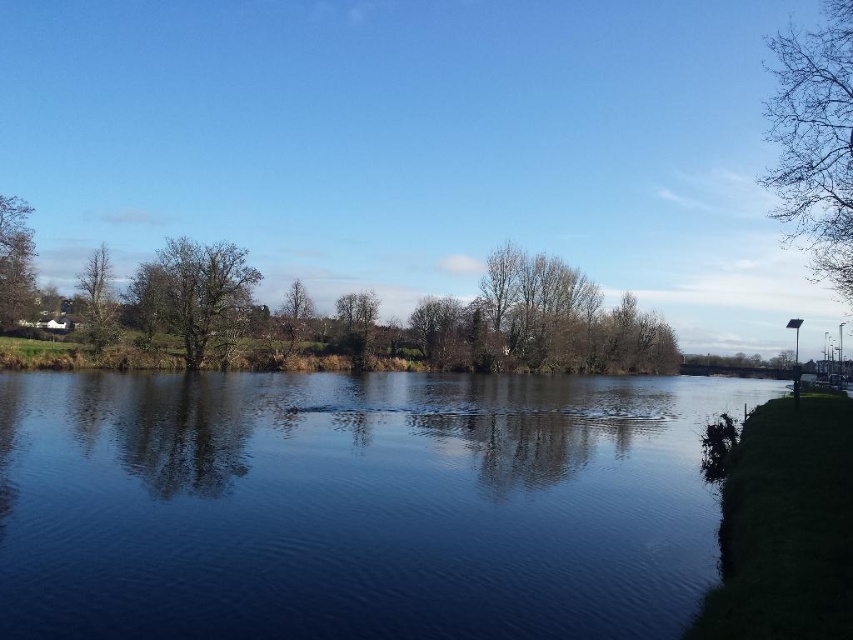
Question: Does blue reflective water at center have a lesser width compared to green leafy tree at left?

Choices:
 (A) no
 (B) yes

Answer: (A)

Question: Which of the following is the farthest from the observer?

Choices:
 (A) (363, 324)
 (B) (157, 252)

Answer: (B)

Question: Which object appears closest to the camera in this image?

Choices:
 (A) green leafy tree at left
 (B) blue reflective water at center

Answer: (B)

Question: Among these objects, which one is nearest to the camera?

Choices:
 (A) green matte tree at center
 (B) green matte tree at left
 (C) green leafy tree at left

Answer: (B)

Question: Is blue reflective water at center to the right of green matte tree at left from the viewer's perspective?

Choices:
 (A) no
 (B) yes

Answer: (B)

Question: Does green leafy tree at left appear under green matte tree at left?

Choices:
 (A) yes
 (B) no

Answer: (B)